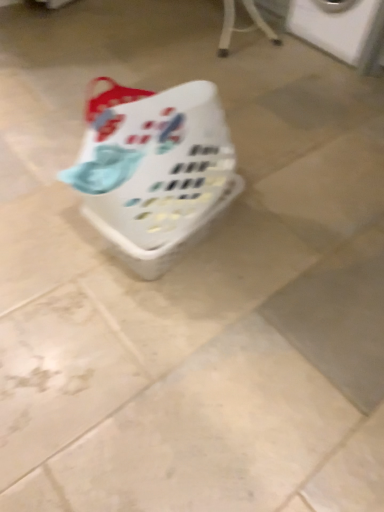
Question: Considering the positions of point (309, 31) and point (223, 166), is point (309, 31) closer or farther from the camera than point (223, 166)?

Choices:
 (A) closer
 (B) farther

Answer: (B)

Question: From the image's perspective, is white plastic washing machine at upper right located above or below white plastic basket at center?

Choices:
 (A) below
 (B) above

Answer: (B)

Question: In terms of size, does white plastic washing machine at upper right appear bigger or smaller than white plastic basket at center?

Choices:
 (A) big
 (B) small

Answer: (A)

Question: Is white plastic basket at center inside or outside of white plastic washing machine at upper right?

Choices:
 (A) outside
 (B) inside

Answer: (A)

Question: From a real-world perspective, is white plastic basket at center above or below white plastic washing machine at upper right?

Choices:
 (A) below
 (B) above

Answer: (A)

Question: Is white plastic basket at center to the left or to the right of white plastic washing machine at upper right in the image?

Choices:
 (A) left
 (B) right

Answer: (A)

Question: Considering the positions of white plastic basket at center and white plastic washing machine at upper right in the image, is white plastic basket at center taller or shorter than white plastic washing machine at upper right?

Choices:
 (A) tall
 (B) short

Answer: (B)